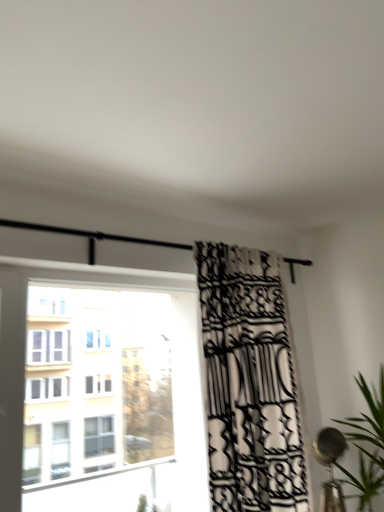
Question: From a real-world perspective, is black and white patterned curtain at center below green leafy plant at right?

Choices:
 (A) yes
 (B) no

Answer: (B)

Question: From the image's perspective, does black and white patterned curtain at center appear lower than green leafy plant at right?

Choices:
 (A) no
 (B) yes

Answer: (A)

Question: Does black and white patterned curtain at center have a larger size compared to green leafy plant at right?

Choices:
 (A) no
 (B) yes

Answer: (B)

Question: Does black and white patterned curtain at center lie in front of green leafy plant at right?

Choices:
 (A) no
 (B) yes

Answer: (A)

Question: Could you tell me if black and white patterned curtain at center is facing green leafy plant at right?

Choices:
 (A) yes
 (B) no

Answer: (A)

Question: From a real-world perspective, relative to green leafy plant at right, is black curtain at upper center vertically above or below?

Choices:
 (A) below
 (B) above

Answer: (B)

Question: Considering the relative positions of black curtain at upper center and green leafy plant at right in the image provided, is black curtain at upper center to the left or to the right of green leafy plant at right?

Choices:
 (A) left
 (B) right

Answer: (A)

Question: From the image's perspective, is black curtain at upper center positioned above or below green leafy plant at right?

Choices:
 (A) above
 (B) below

Answer: (A)

Question: Is point (67, 233) closer or farther from the camera than point (374, 426)?

Choices:
 (A) closer
 (B) farther

Answer: (A)

Question: Is black and white patterned curtain at center situated inside black curtain at upper center or outside?

Choices:
 (A) inside
 (B) outside

Answer: (B)

Question: In the image, is black and white patterned curtain at center on the left side or the right side of black curtain at upper center?

Choices:
 (A) left
 (B) right

Answer: (B)

Question: In terms of size, does black and white patterned curtain at center appear bigger or smaller than black curtain at upper center?

Choices:
 (A) big
 (B) small

Answer: (A)

Question: Is black and white patterned curtain at center wider or thinner than black curtain at upper center?

Choices:
 (A) wide
 (B) thin

Answer: (A)

Question: Is transparent glass window at left spatially inside green leafy plant at right, or outside of it?

Choices:
 (A) inside
 (B) outside

Answer: (B)

Question: Is point (132, 442) positioned closer to the camera than point (359, 490)?

Choices:
 (A) farther
 (B) closer

Answer: (A)